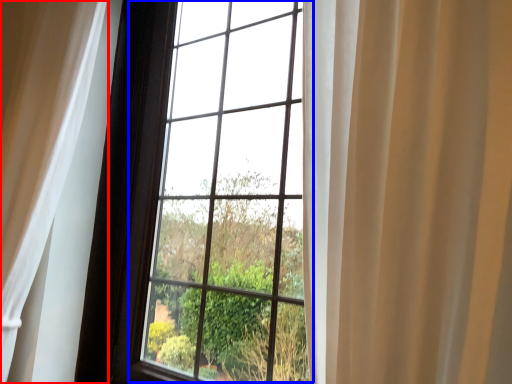
Question: Which object is closer to the camera taking this photo, curtain (highlighted by a red box) or bay window (highlighted by a blue box)?

Choices:
 (A) curtain
 (B) bay window

Answer: (B)